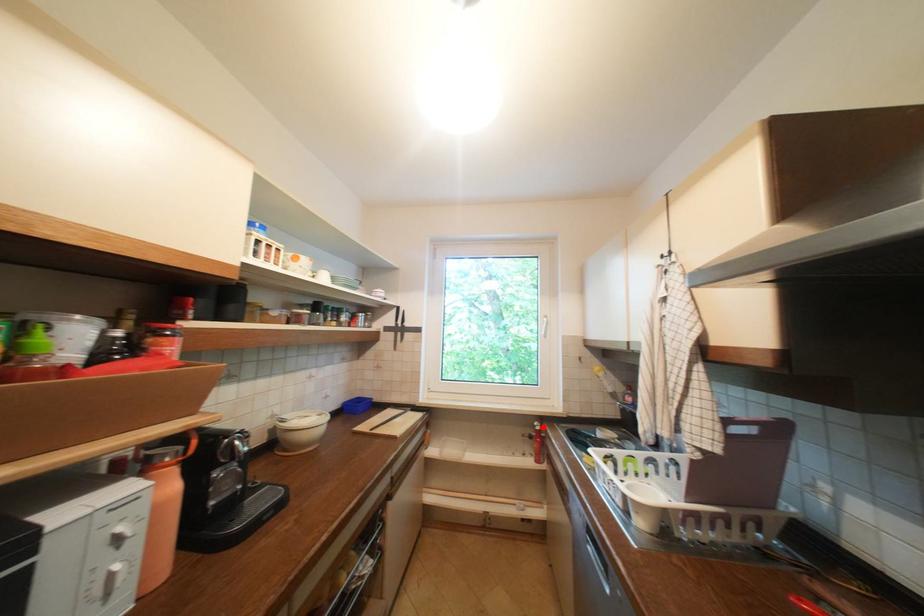
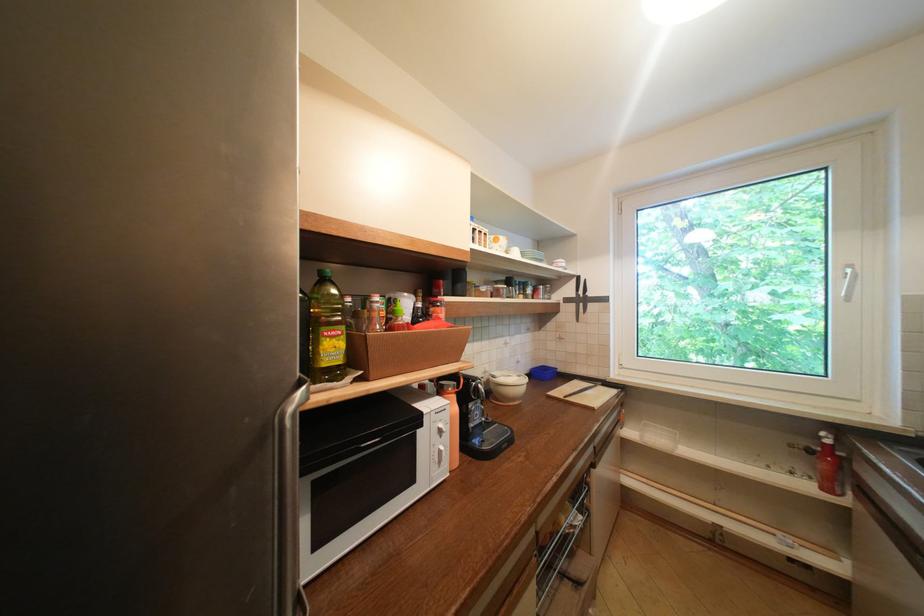
Where in the second image is the point corresponding to the highlighted location from the first image?

(829, 439)